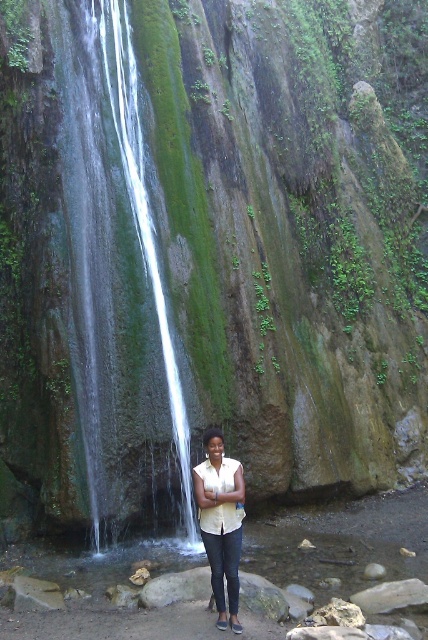
Which of these two, clear glass waterfall at center or matte yellow blouse at center, stands taller?

Standing taller between the two is clear glass waterfall at center.

Image resolution: width=428 pixels, height=640 pixels. What do you see at coordinates (110, 236) in the screenshot? I see `clear glass waterfall at center` at bounding box center [110, 236].

The width and height of the screenshot is (428, 640). Identify the location of clear glass waterfall at center. (110, 236).